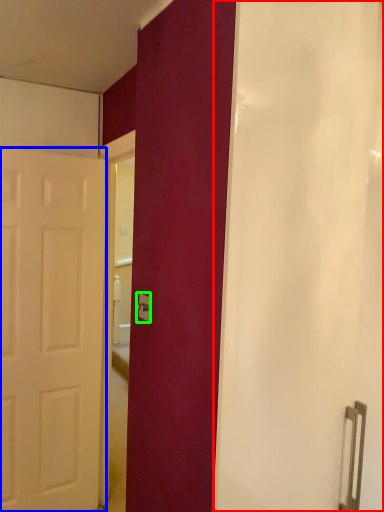
Question: Considering the real-world distances, which object is closest to shower curtain (highlighted by a red box)? door (highlighted by a blue box) or electric outlet (highlighted by a green box).

Choices:
 (A) door
 (B) electric outlet

Answer: (B)